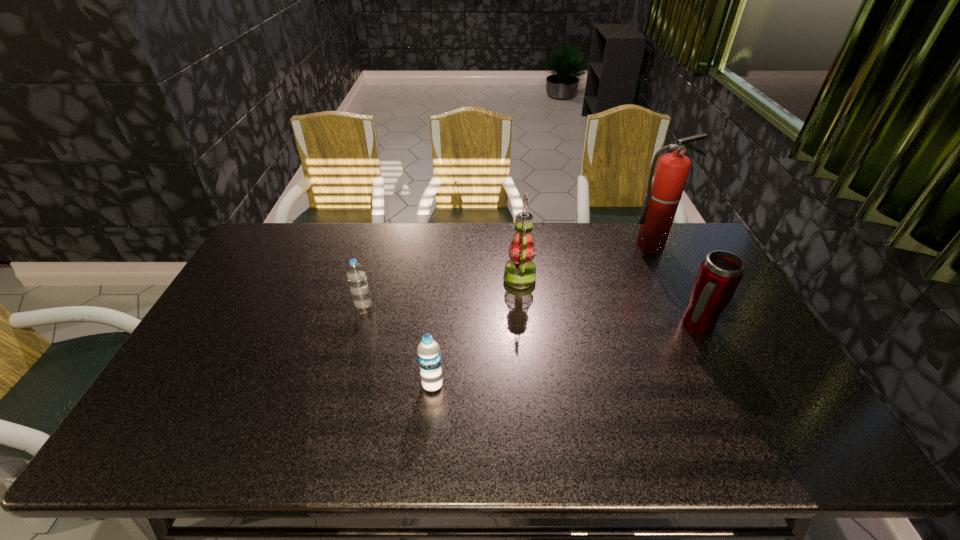
Select which object is the fourth closest to the second object from left to right. Please provide its 2D coordinates. Your answer should be formatted as a tuple, i.e. [(x, y)], where the tuple contains the x and y coordinates of a point satisfying the conditions above.

[(663, 196)]

Identify which object is the third closest to the second object from left to right. Please provide its 2D coordinates. Your answer should be formatted as a tuple, i.e. [(x, y)], where the tuple contains the x and y coordinates of a point satisfying the conditions above.

[(719, 275)]

Image resolution: width=960 pixels, height=540 pixels. I want to click on free space that satisfies the following two spatial constraints: 1. on the back side of the farther water bottle; 2. on the left side of the second tallest object, so click(x=373, y=278).